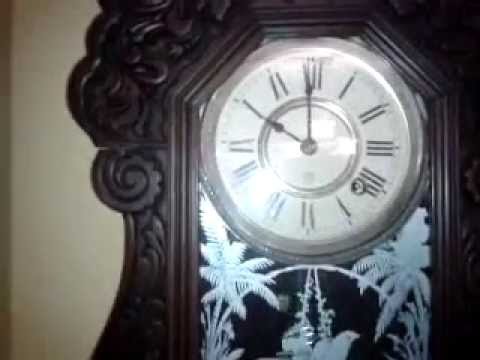
Locate an element on the screen. design on grandfather clock outer shell is located at coordinates (124, 105).